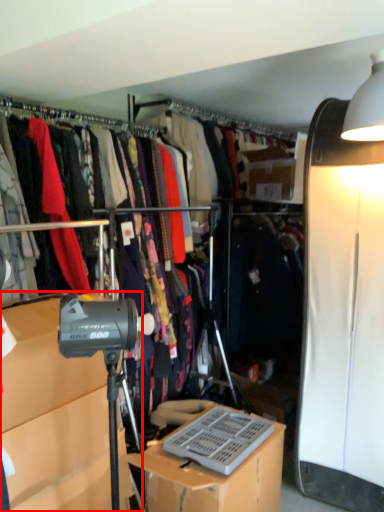
Question: From the image, what is the correct spatial relationship of cabinetry (annotated by the red box) in relation to desk?

Choices:
 (A) left
 (B) right

Answer: (A)